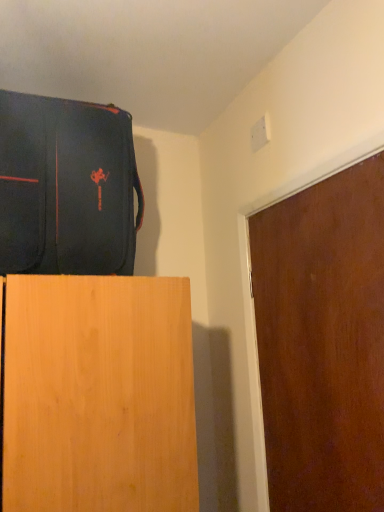
What do you see at coordinates (66, 187) in the screenshot? I see `matte black bag at upper left` at bounding box center [66, 187].

In order to face matte black bag at upper left, should I rotate leftwards or rightwards?

It's best to rotate left around 15.124 degrees.

Measure the distance between matte black bag at upper left and camera.

They are 92.50 centimeters apart.

Locate an element on the screen. This screenshot has width=384, height=512. matte black bag at upper left is located at coordinates (66, 187).

Image resolution: width=384 pixels, height=512 pixels. I want to click on matte black bag at upper left, so click(x=66, y=187).